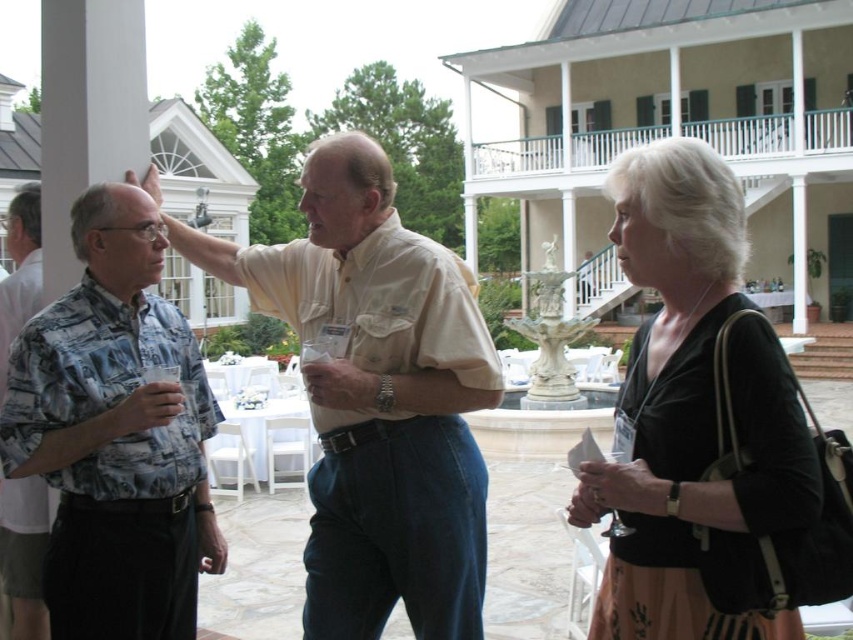
Question: Based on their relative distances, which object is farther from the white wooden porch at upper center?

Choices:
 (A) printed fabric shirt at left
 (B) black velvet dress at center
 (C) light beige cotton shirt at center
 (D) printed fabric shirt at center

Answer: (D)

Question: Is light beige cotton shirt at center closer to the viewer compared to printed fabric shirt at left?

Choices:
 (A) no
 (B) yes

Answer: (A)

Question: Which object is closer to the camera taking this photo?

Choices:
 (A) printed fabric shirt at left
 (B) printed fabric shirt at center
 (C) light beige cotton shirt at center

Answer: (B)

Question: Can you confirm if black velvet dress at center is thinner than printed fabric shirt at left?

Choices:
 (A) yes
 (B) no

Answer: (B)

Question: Which of these objects is positioned farthest from the printed fabric shirt at center?

Choices:
 (A) light beige cotton shirt at center
 (B) white wooden porch at upper center

Answer: (B)

Question: Can you confirm if light beige cotton shirt at center is wider than printed fabric shirt at left?

Choices:
 (A) yes
 (B) no

Answer: (A)